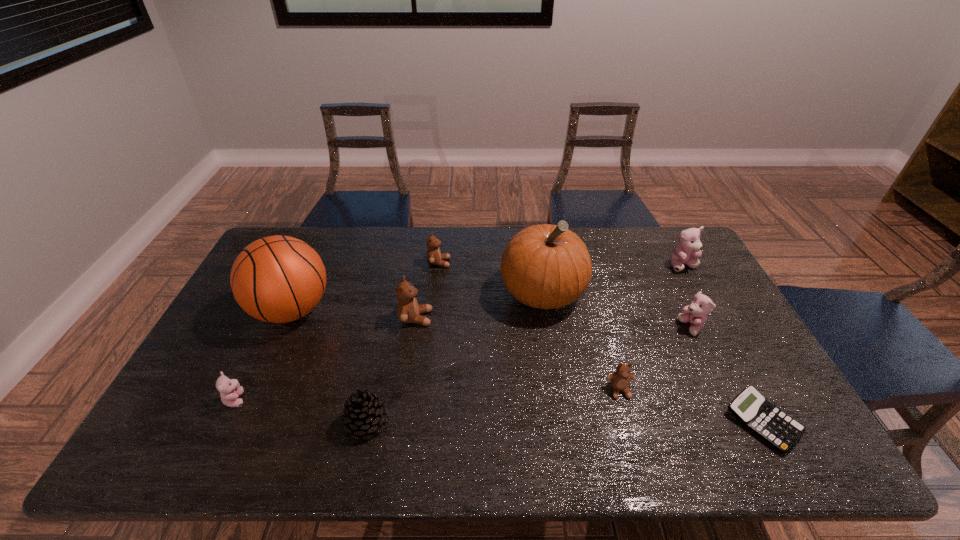
Where is `free space located at the narrow end of the pinecone`? free space located at the narrow end of the pinecone is located at coordinates (479, 422).

Identify the location of free region located on the front-facing side of the fourth teddy bear from left to right. (632, 433).

Where is `free region located 0.260m at the face of the smallest pink teddy bear`? This screenshot has width=960, height=540. free region located 0.260m at the face of the smallest pink teddy bear is located at coordinates (350, 399).

You are a GUI agent. You are given a task and a screenshot of the screen. Output one action in this format:
    pyautogui.click(x=<x>, y=<y>)
    Task: Click on the vacant area situated on the back of the calculator
    The image size is (960, 540).
    Given the screenshot: What is the action you would take?
    pyautogui.click(x=696, y=298)

Identify the location of pumpkin that is at the far edge. The height and width of the screenshot is (540, 960). (545, 266).

You are a GUI agent. You are given a task and a screenshot of the screen. Output one action in this format:
    pyautogui.click(x=<x>, y=<y>)
    Task: Click on the pinecone that is at the near edge
    This screenshot has height=540, width=960.
    Given the screenshot: What is the action you would take?
    tap(364, 412)

Find the location of a particular element. Image resolution: width=960 pixels, height=540 pixels. calculator situated at the near edge is located at coordinates (751, 408).

The height and width of the screenshot is (540, 960). I want to click on basketball that is at the left edge, so click(277, 279).

Locate an element on the screen. The image size is (960, 540). teddy bear situated at the left edge is located at coordinates (230, 389).

I want to click on calculator that is at the right edge, so (x=751, y=408).